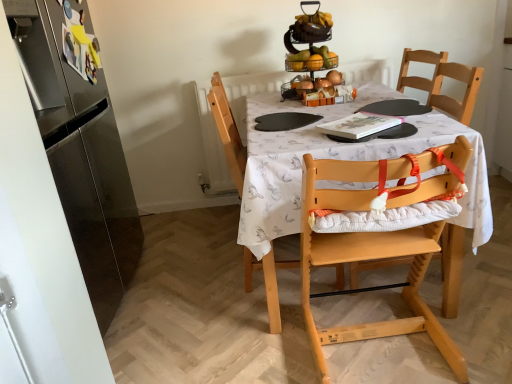
In order to click on vacant area that lies to the right of satin silver refrigerator at left in this screenshot , I will do `click(190, 292)`.